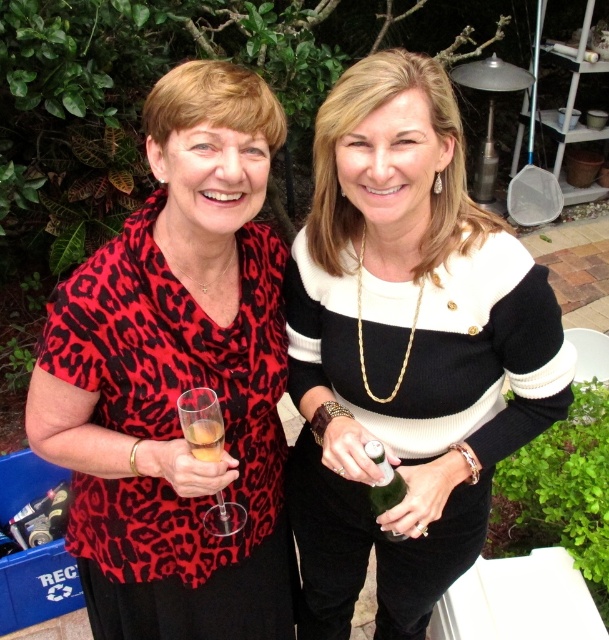
Question: Can you confirm if green glass bottle at center is bigger than clear glass at center?

Choices:
 (A) no
 (B) yes

Answer: (B)

Question: Which object appears farthest from the camera in this image?

Choices:
 (A) green glass bottle at center
 (B) black and white sweater at center
 (C) leopard print blouse at left
 (D) clear glass wine glass at center

Answer: (A)

Question: Is leopard print blouse at left in front of clear glass at center?

Choices:
 (A) yes
 (B) no

Answer: (B)

Question: Which point is closer to the camera?

Choices:
 (A) (209, 397)
 (B) (209, 458)
 (C) (404, 492)

Answer: (B)

Question: In this image, where is leopard print blouse at left located relative to clear glass wine glass at center?

Choices:
 (A) right
 (B) left

Answer: (B)

Question: Which point is closer to the camera?

Choices:
 (A) (392, 490)
 (B) (354, 275)
 (C) (183, 429)
 (D) (194, 435)

Answer: (C)